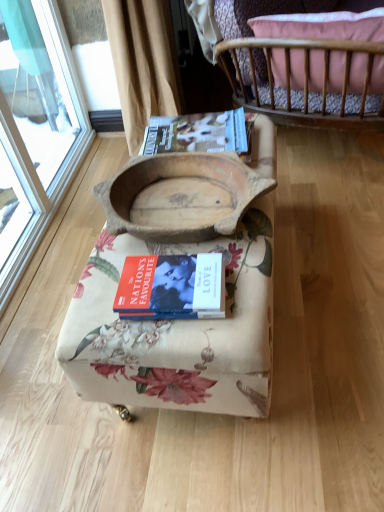
The height and width of the screenshot is (512, 384). I want to click on vacant area that is in front of hardcover book at center, so click(185, 338).